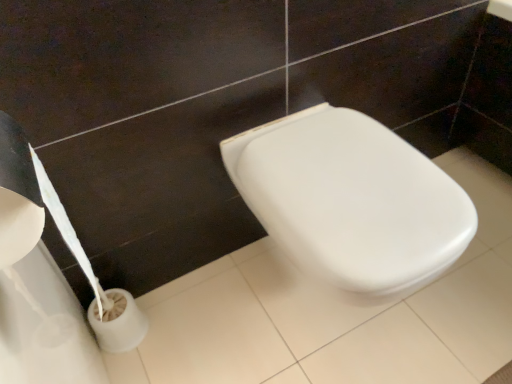
In order to click on vacant region under white glossy toilet at center (from a real-world perspective) in this screenshot , I will do `click(330, 314)`.